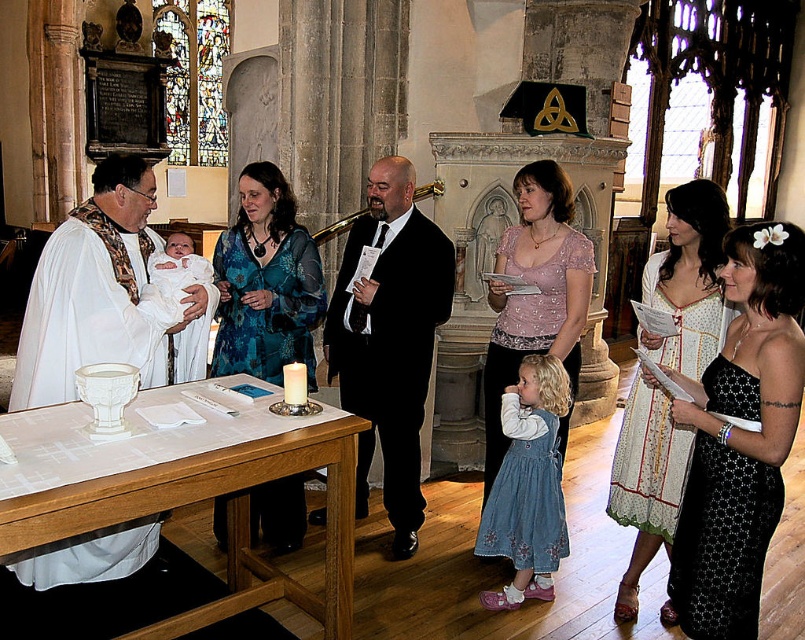
Which is below, black satin suit at center or printed cotton dress at center?

printed cotton dress at center is below.

Is point (411, 333) closer to camera compared to point (676, 500)?

No, it is not.

Is point (362, 413) positioned in front of point (680, 304)?

No, (362, 413) is further to viewer.

The image size is (805, 640). In order to click on black satin suit at center in this screenshot , I will do `click(389, 339)`.

Which is more to the left, black satin suit at center or pale pink lace blouse at center?

From the viewer's perspective, black satin suit at center appears more on the left side.

Which is more to the right, black satin suit at center or pale pink lace blouse at center?

pale pink lace blouse at center is more to the right.

Between point (428, 348) and point (572, 321), which one is positioned behind?

The point (428, 348) is behind.

Where is `black satin suit at center`? black satin suit at center is located at coordinates (389, 339).

Does blue floral dress at center appear on the left side of pale pink lace blouse at center?

Indeed, blue floral dress at center is positioned on the left side of pale pink lace blouse at center.

Is blue floral dress at center above pale pink lace blouse at center?

Indeed, blue floral dress at center is positioned over pale pink lace blouse at center.

Identify the location of blue floral dress at center. The image size is (805, 640). (266, 282).